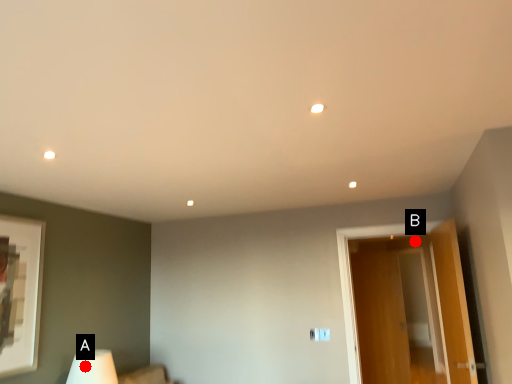
Question: Two points are circled on the image, labeled by A and B beside each circle. Among these points, which one is nearest to the camera?

Choices:
 (A) A is closer
 (B) B is closer

Answer: (A)